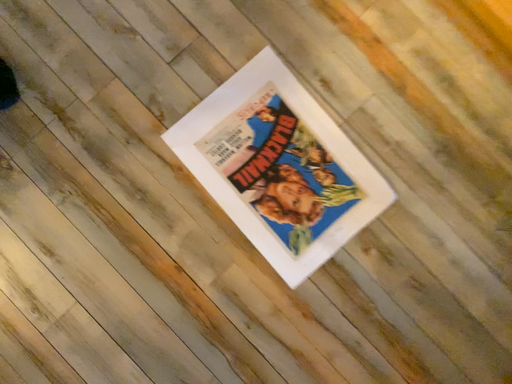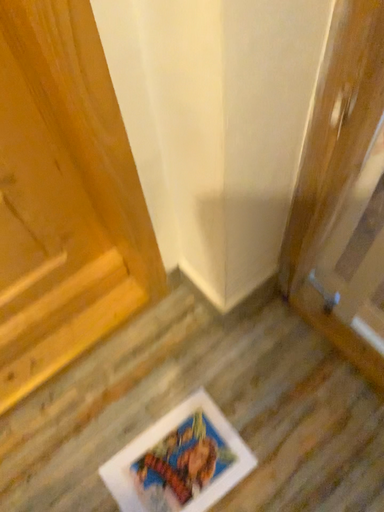
Question: Which way did the camera rotate in the video?

Choices:
 (A) rotated upward
 (B) rotated downward

Answer: (A)